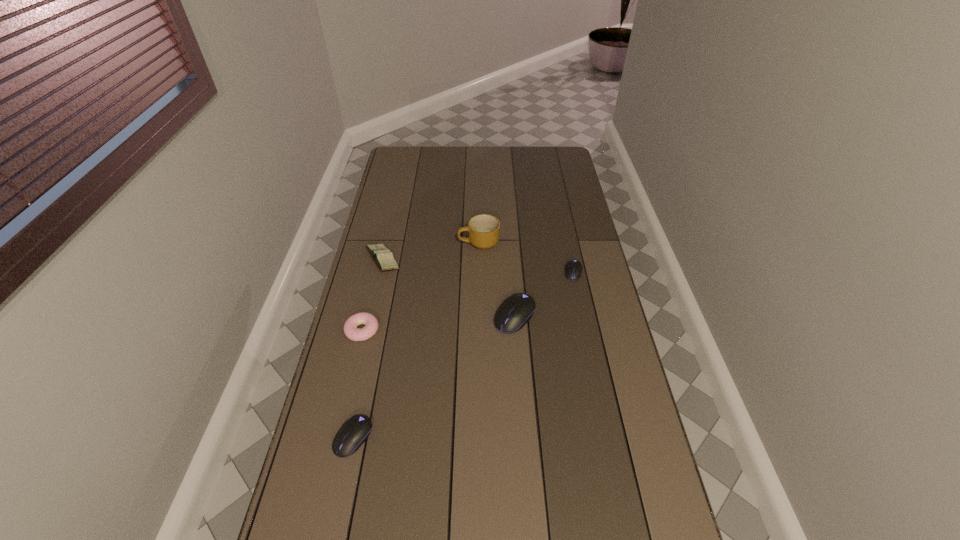
Where is `vacant area that lies between the nearest object and the shortest object`? This screenshot has height=540, width=960. vacant area that lies between the nearest object and the shortest object is located at coordinates (464, 355).

Where is `vacant area that lies between the second shortest computer mouse and the doughnut`? vacant area that lies between the second shortest computer mouse and the doughnut is located at coordinates (358, 384).

I want to click on vacant space that's between the rightmost object and the mug, so click(x=526, y=258).

This screenshot has width=960, height=540. In order to click on vacant area that lies between the mug and the diary in this screenshot , I will do click(x=431, y=251).

Where is `free space between the rightmost computer mouse and the diary`? free space between the rightmost computer mouse and the diary is located at coordinates (478, 266).

Locate an element on the screen. free space between the mug and the diary is located at coordinates (431, 251).

This screenshot has height=540, width=960. What are the coordinates of `object that ranks as the fifth closest to the diary` in the screenshot? It's located at (573, 272).

Where is `object that stands as the second closest to the second farthest computer mouse`? object that stands as the second closest to the second farthest computer mouse is located at coordinates (483, 230).

Identify which computer mouse is located as the nearest to the doughnut. Please provide its 2D coordinates. Your answer should be formatted as a tuple, i.e. [(x, y)], where the tuple contains the x and y coordinates of a point satisfying the conditions above.

[(354, 432)]

Point out which computer mouse is positioned as the third nearest to the tallest object. Please provide its 2D coordinates. Your answer should be formatted as a tuple, i.e. [(x, y)], where the tuple contains the x and y coordinates of a point satisfying the conditions above.

[(354, 432)]